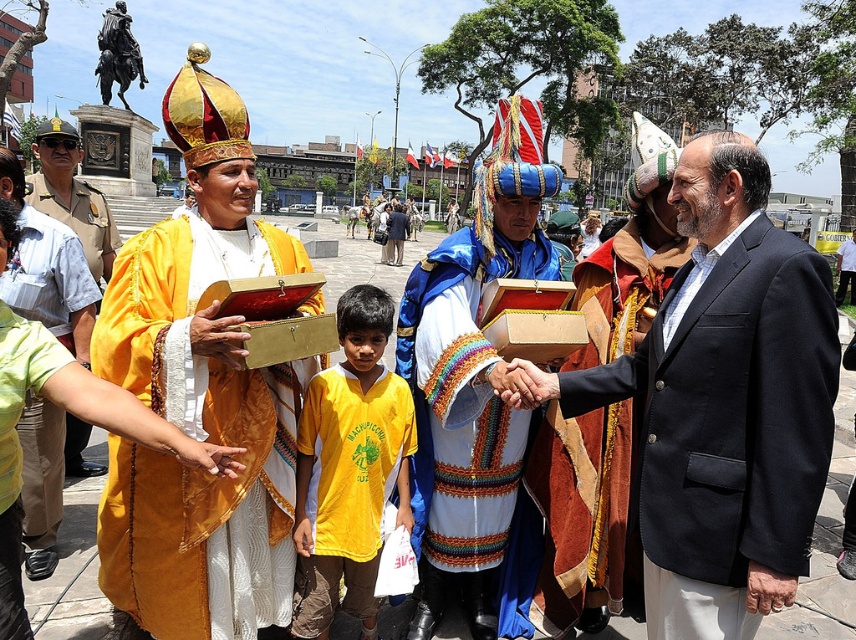
Question: Which point is closer to the camera?

Choices:
 (A) coord(770,586)
 (B) coord(169,404)

Answer: (A)

Question: Can you confirm if dark blue suit at center is positioned above matte gold robe at left?

Choices:
 (A) yes
 (B) no

Answer: (B)

Question: Which point is closer to the camera?

Choices:
 (A) dark blue suit at center
 (B) yellow jersey at center
 (C) yellow velvet robe at center
 (D) matte gold vestment at left

Answer: (A)

Question: Is dark blue suit at center wider than matte gold robe at left?

Choices:
 (A) yes
 (B) no

Answer: (B)

Question: Can you confirm if dark blue suit at center is thinner than yellow velvet robe at center?

Choices:
 (A) no
 (B) yes

Answer: (B)

Question: Among these points, which one is farthest from the camera?

Choices:
 (A) (81, 212)
 (B) (316, 378)
 (C) (403, 227)

Answer: (C)